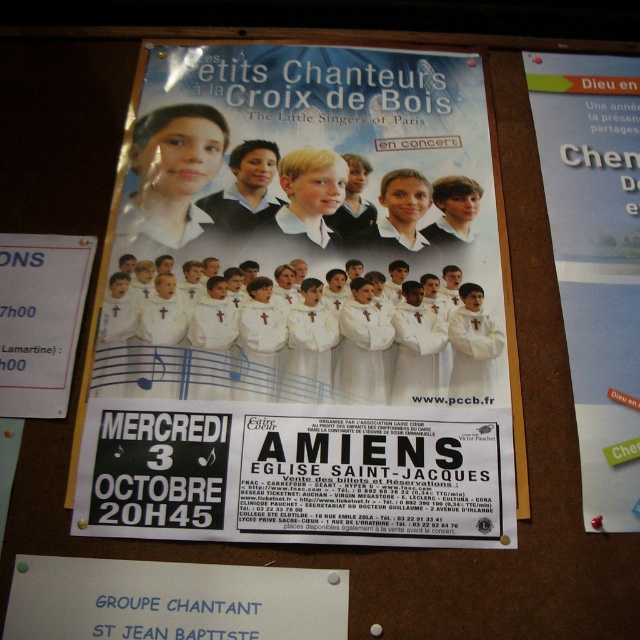
Question: Can you confirm if white paper poster at center is positioned to the left of white paper at upper right?

Choices:
 (A) yes
 (B) no

Answer: (A)

Question: Is white paper poster at center wider than white paper at upper right?

Choices:
 (A) yes
 (B) no

Answer: (A)

Question: Which object appears farthest from the camera in this image?

Choices:
 (A) white paper poster at center
 (B) white paper at upper right

Answer: (B)

Question: Where is white paper poster at center located in relation to white paper at upper right in the image?

Choices:
 (A) above
 (B) below

Answer: (B)

Question: Which point is farther to the camera?

Choices:
 (A) white paper at upper right
 (B) white paper poster at center

Answer: (A)